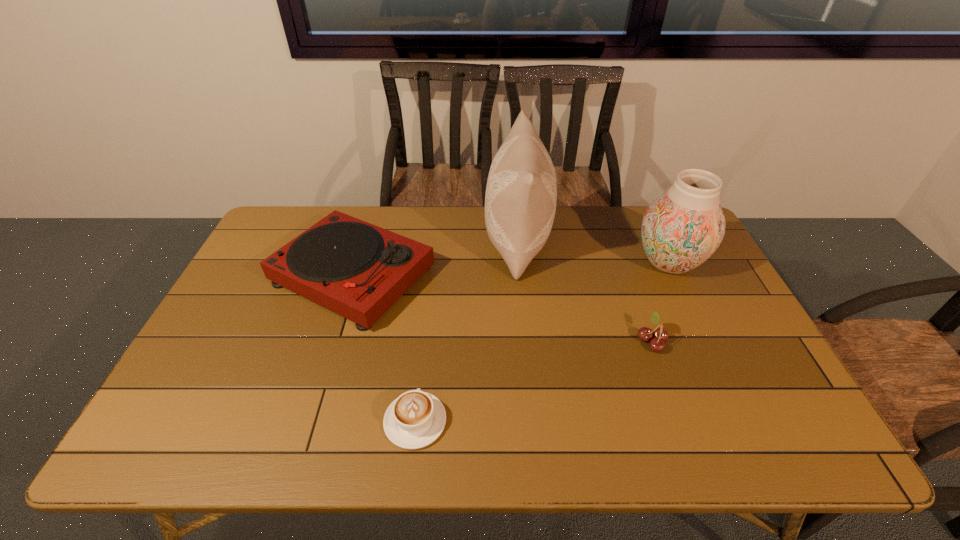
The image size is (960, 540). What are the coordinates of `free space at the far left corner` in the screenshot? It's located at (320, 215).

The image size is (960, 540). Identify the location of free region at the far right corner of the desktop. (645, 208).

Locate an element on the screen. The image size is (960, 540). free space between the cherry and the cushion is located at coordinates (585, 291).

At what (x,y) coordinates should I click in order to perform the action: click on vacant area between the fourth shortest object and the cushion. Please return your answer as a coordinate pair (x, y). This screenshot has height=540, width=960. Looking at the image, I should click on click(x=593, y=252).

I want to click on free spot between the cushion and the cherry, so click(x=585, y=291).

At what (x,y) coordinates should I click in order to perform the action: click on free space between the vase and the third object from left to right. Please return your answer as a coordinate pair (x, y). This screenshot has width=960, height=540. Looking at the image, I should click on (593, 252).

I want to click on vacant area that lies between the cherry and the second tallest object, so click(660, 302).

You are a GUI agent. You are given a task and a screenshot of the screen. Output one action in this format:
    pyautogui.click(x=<x>, y=<y>)
    Task: Click on the vacant space in between the nearest object and the record player
    Image resolution: width=960 pixels, height=540 pixels.
    Given the screenshot: What is the action you would take?
    pyautogui.click(x=384, y=348)

This screenshot has height=540, width=960. Identify the location of empty space that is in between the cushion and the cherry. (585, 291).

This screenshot has width=960, height=540. Identify the location of empty space between the third tallest object and the cherry. (502, 308).